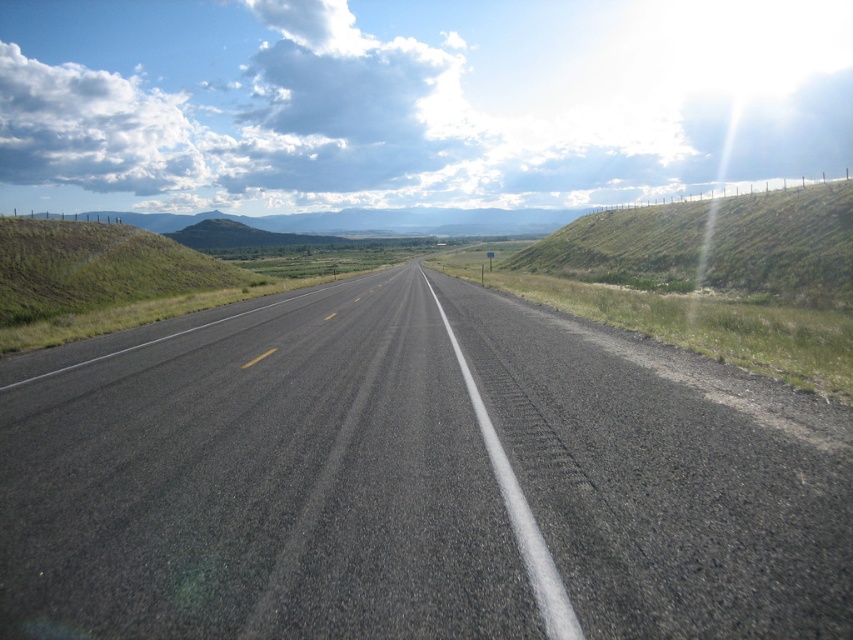
Question: Which object appears farthest from the camera in this image?

Choices:
 (A) green grassy hillside at right
 (B) green grassy hillside at left

Answer: (A)

Question: Is black asphalt road at center behind green grassy hillside at right?

Choices:
 (A) no
 (B) yes

Answer: (A)

Question: Which point appears closest to the camera in this image?

Choices:
 (A) (59, 300)
 (B) (682, 285)
 (C) (618, 362)

Answer: (C)

Question: Is black asphalt road at center further to camera compared to green grassy hillside at left?

Choices:
 (A) yes
 (B) no

Answer: (B)

Question: Among these points, which one is farthest from the camera?

Choices:
 (A) (693, 541)
 (B) (64, 246)
 (C) (833, 272)

Answer: (B)

Question: Is green grassy hillside at right bigger than green grassy hillside at left?

Choices:
 (A) no
 (B) yes

Answer: (B)